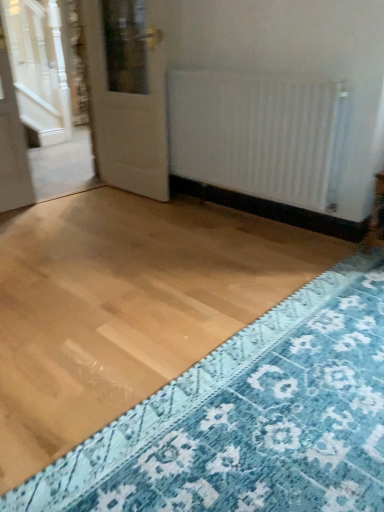
Question: Does white matte radiator at center have a smaller size compared to blue textured rug at lower right?

Choices:
 (A) no
 (B) yes

Answer: (A)

Question: From the image's perspective, is white matte radiator at center beneath blue textured rug at lower right?

Choices:
 (A) no
 (B) yes

Answer: (A)

Question: Could you tell me if white matte radiator at center is facing blue textured rug at lower right?

Choices:
 (A) yes
 (B) no

Answer: (B)

Question: From the image's perspective, does white matte radiator at center appear higher than blue textured rug at lower right?

Choices:
 (A) yes
 (B) no

Answer: (A)

Question: Is white matte radiator at center closer to camera compared to blue textured rug at lower right?

Choices:
 (A) no
 (B) yes

Answer: (A)

Question: Considering the relative sizes of white matte radiator at center and blue textured rug at lower right in the image provided, is white matte radiator at center bigger than blue textured rug at lower right?

Choices:
 (A) yes
 (B) no

Answer: (A)

Question: Is blue textured rug at lower right facing away from white matte radiator at center?

Choices:
 (A) yes
 (B) no

Answer: (B)

Question: Is the depth of blue textured rug at lower right greater than that of white matte radiator at center?

Choices:
 (A) no
 (B) yes

Answer: (A)

Question: Could you tell me if blue textured rug at lower right is facing white matte radiator at center?

Choices:
 (A) yes
 (B) no

Answer: (B)

Question: Does blue textured rug at lower right appear on the right side of white matte radiator at center?

Choices:
 (A) yes
 (B) no

Answer: (A)

Question: Can you confirm if blue textured rug at lower right is taller than white matte radiator at center?

Choices:
 (A) yes
 (B) no

Answer: (B)

Question: Is white matte radiator at center completely or partially inside blue textured rug at lower right?

Choices:
 (A) yes
 (B) no

Answer: (B)

Question: Is white glossy door at upper left thinner than blue textured rug at lower right?

Choices:
 (A) yes
 (B) no

Answer: (A)